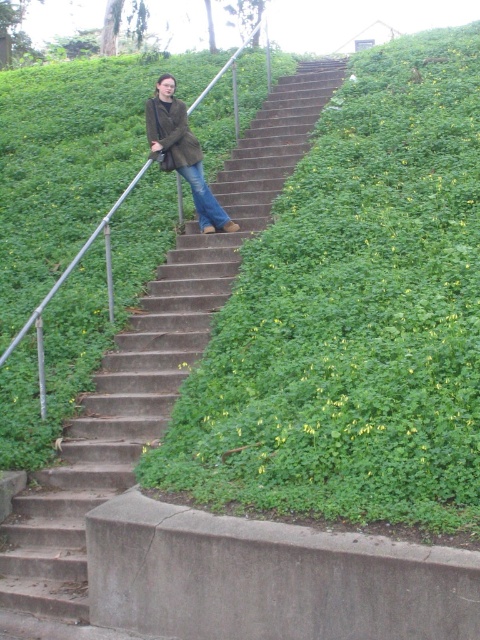
Question: Based on their relative distances, which object is nearer to the blue denim jeans at center?

Choices:
 (A) matte brown jacket at upper center
 (B) concrete stairs at center
 (C) matte brown coat at center

Answer: (C)

Question: Which object is positioned farthest from the blue denim jeans at center?

Choices:
 (A) matte brown coat at center
 (B) matte brown jacket at upper center

Answer: (B)

Question: Is matte brown coat at center below blue denim jeans at center?

Choices:
 (A) yes
 (B) no

Answer: (B)

Question: Which object is positioned farthest from the concrete stairs at center?

Choices:
 (A) matte brown coat at center
 (B) blue denim jeans at center

Answer: (A)

Question: Can you confirm if concrete stairs at center is positioned to the right of matte brown coat at center?

Choices:
 (A) yes
 (B) no

Answer: (A)

Question: Is concrete stairs at center wider than blue denim jeans at center?

Choices:
 (A) yes
 (B) no

Answer: (A)